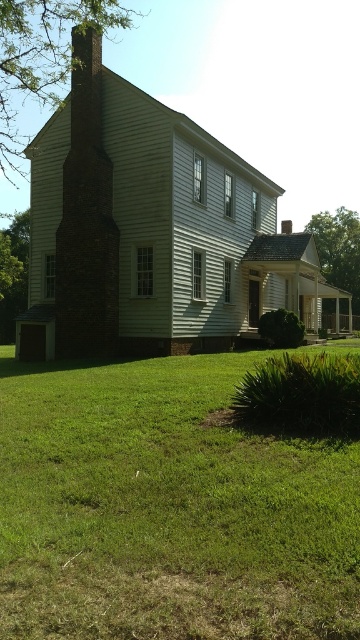
Question: Does green grass at lower center appear under brick chimney at left?

Choices:
 (A) yes
 (B) no

Answer: (A)

Question: Does green grass at lower center have a smaller size compared to brick chimney at left?

Choices:
 (A) no
 (B) yes

Answer: (B)

Question: Which of the following is the closest to the observer?

Choices:
 (A) (5, 528)
 (B) (95, 291)

Answer: (A)

Question: In this image, where is green grass at lower center located relative to brick chimney at left?

Choices:
 (A) left
 (B) right

Answer: (B)